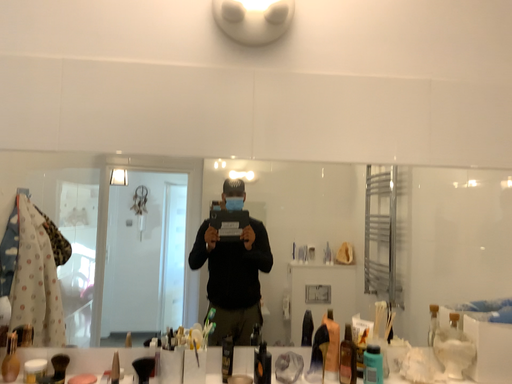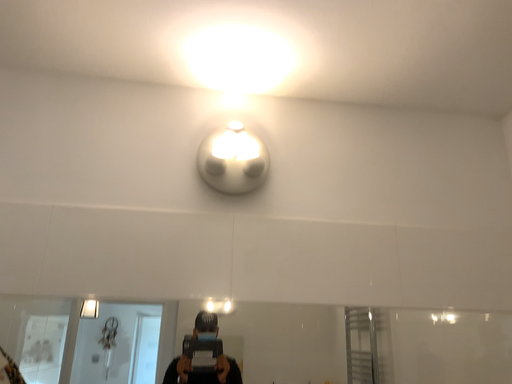
Question: How did the camera likely rotate when shooting the video?

Choices:
 (A) rotated upward
 (B) rotated downward

Answer: (A)